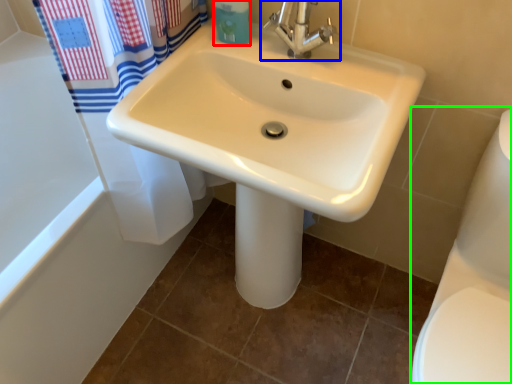
Question: Based on their relative distances, which object is nearer to toiletry (highlighted by a red box)? Choose from tap (highlighted by a blue box) and toilet bowl (highlighted by a green box).

Choices:
 (A) tap
 (B) toilet bowl

Answer: (A)